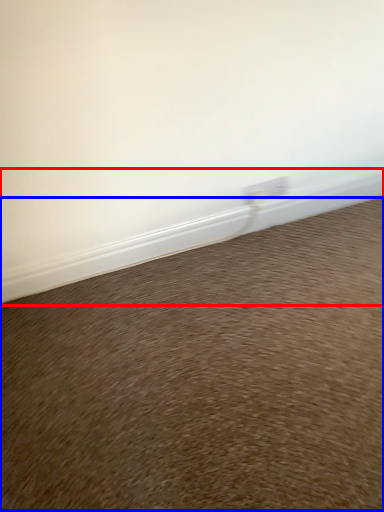
Question: Which object is closer to the camera taking this photo, window sill (highlighted by a red box) or sand (highlighted by a blue box)?

Choices:
 (A) window sill
 (B) sand

Answer: (B)